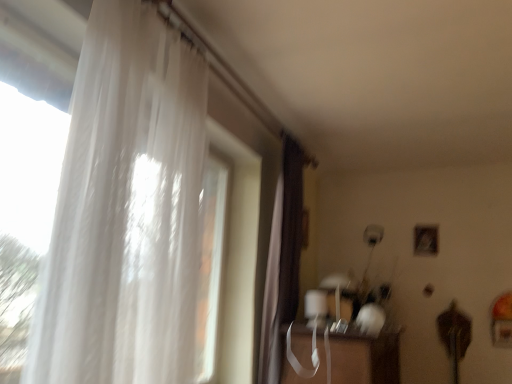
This screenshot has height=384, width=512. Describe the element at coordinates (282, 261) in the screenshot. I see `brown velvet curtain at center, arranged as the second curtain when viewed from the left` at that location.

Looking at this image, measure the distance between transparent plastic table at lower center and camera.

The distance of transparent plastic table at lower center from camera is 2.28 meters.

The image size is (512, 384). What do you see at coordinates (365, 358) in the screenshot?
I see `transparent plastic table at lower center` at bounding box center [365, 358].

You are a GUI agent. You are given a task and a screenshot of the screen. Output one action in this format:
    pyautogui.click(x=<x>, y=<y>)
    Task: Click on the translucent white curtain at left, the 2th curtain when ordered from right to left
    
    Given the screenshot: What is the action you would take?
    pyautogui.click(x=126, y=209)

What do you see at coordinates (126, 209) in the screenshot? I see `translucent white curtain at left, the first curtain when ordered from front to back` at bounding box center [126, 209].

Locate an element on the screen. brown velvet curtain at center, which is the 1th curtain in back-to-front order is located at coordinates (282, 261).

How much distance is there between transparent plastic table at lower center and brown velvet curtain at center, positioned as the 2th curtain in front-to-back order?

transparent plastic table at lower center is 16.01 inches from brown velvet curtain at center, positioned as the 2th curtain in front-to-back order.

Is transparent plastic table at lower center next to brown velvet curtain at center, positioned as the 2th curtain in front-to-back order, and touching it?

transparent plastic table at lower center is not next to brown velvet curtain at center, positioned as the 2th curtain in front-to-back order, and they're not touching.

From the image's perspective, is transparent plastic table at lower center located above brown velvet curtain at center, which is the 1th curtain in back-to-front order?

No, from the image's perspective, transparent plastic table at lower center is not on top of brown velvet curtain at center, which is the 1th curtain in back-to-front order.

Do you think brown velvet curtain at center, arranged as the second curtain when viewed from the left, is within translucent white curtain at left, the second curtain viewed from the back, or outside of it?

brown velvet curtain at center, arranged as the second curtain when viewed from the left, lies outside translucent white curtain at left, the second curtain viewed from the back.

In the image, is brown velvet curtain at center, which is the 1th curtain in right-to-left order, positioned in front of or behind translucent white curtain at left, the 2th curtain when ordered from right to left?

Clearly, brown velvet curtain at center, which is the 1th curtain in right-to-left order, is behind translucent white curtain at left, the 2th curtain when ordered from right to left.

What's the angular difference between brown velvet curtain at center, which is the 1th curtain in back-to-front order, and translucent white curtain at left, the first curtain when ordered from front to back,'s facing directions?

4.07 degrees.

From a real-world perspective, does brown velvet curtain at center, which is the 1th curtain in back-to-front order, sit lower than translucent white curtain at left, the second curtain viewed from the back?

Yes, from a real-world perspective, brown velvet curtain at center, which is the 1th curtain in back-to-front order, is beneath translucent white curtain at left, the second curtain viewed from the back.

Is transparent plastic table at lower center oriented away from translucent white curtain at left, marked as the first curtain in a left-to-right arrangement?

No, transparent plastic table at lower center is not facing away from translucent white curtain at left, marked as the first curtain in a left-to-right arrangement.

Would you say transparent plastic table at lower center is a long distance from translucent white curtain at left, the first curtain when ordered from front to back?

Yes, transparent plastic table at lower center and translucent white curtain at left, the first curtain when ordered from front to back, are located far from each other.

From the image's perspective, relative to translucent white curtain at left, marked as the first curtain in a left-to-right arrangement, is transparent plastic table at lower center above or below?

Clearly, from the image's perspective, transparent plastic table at lower center is below translucent white curtain at left, marked as the first curtain in a left-to-right arrangement.

From a real-world perspective, is transparent plastic table at lower center physically located above or below translucent white curtain at left, the 2th curtain when ordered from right to left?

Clearly, from a real-world perspective, transparent plastic table at lower center is below translucent white curtain at left, the 2th curtain when ordered from right to left.

Is translucent white curtain at left, the 2th curtain when ordered from right to left, positioned before brown velvet curtain at center, arranged as the second curtain when viewed from the left?

Yes.

Between translucent white curtain at left, the 2th curtain when ordered from right to left, and brown velvet curtain at center, positioned as the 2th curtain in front-to-back order, which one has larger size?

With larger size is translucent white curtain at left, the 2th curtain when ordered from right to left.

How different are the orientations of translucent white curtain at left, marked as the first curtain in a left-to-right arrangement, and brown velvet curtain at center, which is the 1th curtain in back-to-front order, in degrees?

They differ by 4.07 degrees in their facing directions.

The image size is (512, 384). In order to click on curtain on the left of brown velvet curtain at center, arranged as the second curtain when viewed from the left in this screenshot , I will do `click(126, 209)`.

How many degrees apart are the facing directions of brown velvet curtain at center, positioned as the 2th curtain in front-to-back order, and transparent plastic table at lower center?

There is a 1.62-degree angle between the facing directions of brown velvet curtain at center, positioned as the 2th curtain in front-to-back order, and transparent plastic table at lower center.

Considering the positions of objects brown velvet curtain at center, which is the 1th curtain in back-to-front order, and transparent plastic table at lower center in the image provided, who is more to the left, brown velvet curtain at center, which is the 1th curtain in back-to-front order, or transparent plastic table at lower center?

From the viewer's perspective, brown velvet curtain at center, which is the 1th curtain in back-to-front order, appears more on the left side.

Between brown velvet curtain at center, which is the 1th curtain in back-to-front order, and transparent plastic table at lower center, which one has larger size?

transparent plastic table at lower center is bigger.

This screenshot has width=512, height=384. What are the coordinates of `table lying on the right of brown velvet curtain at center, which is the 1th curtain in back-to-front order` in the screenshot? It's located at (365, 358).

Which of these two, translucent white curtain at left, the first curtain when ordered from front to back, or transparent plastic table at lower center, stands shorter?

With less height is transparent plastic table at lower center.

Is translucent white curtain at left, the second curtain viewed from the back, not inside transparent plastic table at lower center?

Yes, translucent white curtain at left, the second curtain viewed from the back, is located beyond the bounds of transparent plastic table at lower center.

In the scene shown: Which object is positioned more to the right, translucent white curtain at left, the first curtain when ordered from front to back, or transparent plastic table at lower center?

transparent plastic table at lower center is more to the right.

Could you tell me if translucent white curtain at left, marked as the first curtain in a left-to-right arrangement, is turned towards transparent plastic table at lower center?

No, translucent white curtain at left, marked as the first curtain in a left-to-right arrangement, is not oriented towards transparent plastic table at lower center.

In order to click on the 1st curtain counting from the left of the transparent plastic table at lower center in this screenshot , I will do `click(282, 261)`.

This screenshot has height=384, width=512. I want to click on curtain located above the brown velvet curtain at center, which is the 1th curtain in right-to-left order (from the image's perspective), so click(126, 209).

Estimate the real-world distances between objects in this image. Which object is further from brown velvet curtain at center, which is the 1th curtain in right-to-left order, transparent plastic table at lower center or translucent white curtain at left, the first curtain when ordered from front to back?

translucent white curtain at left, the first curtain when ordered from front to back, is further to brown velvet curtain at center, which is the 1th curtain in right-to-left order.

From the image, which object appears to be farther from translucent white curtain at left, marked as the first curtain in a left-to-right arrangement, transparent plastic table at lower center or brown velvet curtain at center, positioned as the 2th curtain in front-to-back order?

transparent plastic table at lower center is positioned further to the anchor translucent white curtain at left, marked as the first curtain in a left-to-right arrangement.

Looking at the image, which one is located further to translucent white curtain at left, the second curtain viewed from the back, brown velvet curtain at center, which is the 1th curtain in back-to-front order, or transparent plastic table at lower center?

The object further to translucent white curtain at left, the second curtain viewed from the back, is transparent plastic table at lower center.

Estimate the real-world distances between objects in this image. Which object is closer to transparent plastic table at lower center, translucent white curtain at left, the second curtain viewed from the back, or brown velvet curtain at center, which is the 1th curtain in back-to-front order?

Among the two, brown velvet curtain at center, which is the 1th curtain in back-to-front order, is located nearer to transparent plastic table at lower center.

Looking at the image, which one is located closer to brown velvet curtain at center, which is the 1th curtain in back-to-front order, translucent white curtain at left, the 2th curtain when ordered from right to left, or transparent plastic table at lower center?

transparent plastic table at lower center is closer to brown velvet curtain at center, which is the 1th curtain in back-to-front order.

Estimate the real-world distances between objects in this image. Which object is closer to transparent plastic table at lower center, brown velvet curtain at center, which is the 1th curtain in right-to-left order, or translucent white curtain at left, the first curtain when ordered from front to back?

brown velvet curtain at center, which is the 1th curtain in right-to-left order.

Identify the location of table between translucent white curtain at left, the first curtain when ordered from front to back, and brown velvet curtain at center, which is the 1th curtain in right-to-left order, in the front-back direction. (365, 358).